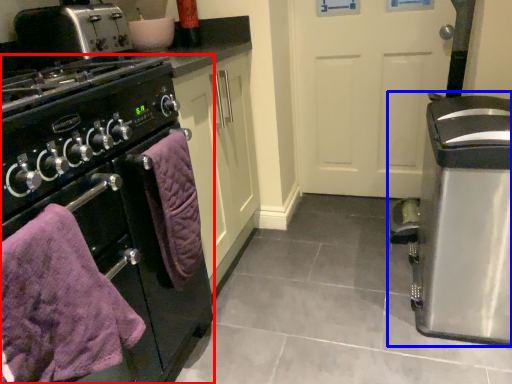
Question: Which point is further to the camera, home appliance (highlighted by a red box) or kitchen appliance (highlighted by a blue box)?

Choices:
 (A) home appliance
 (B) kitchen appliance

Answer: (B)